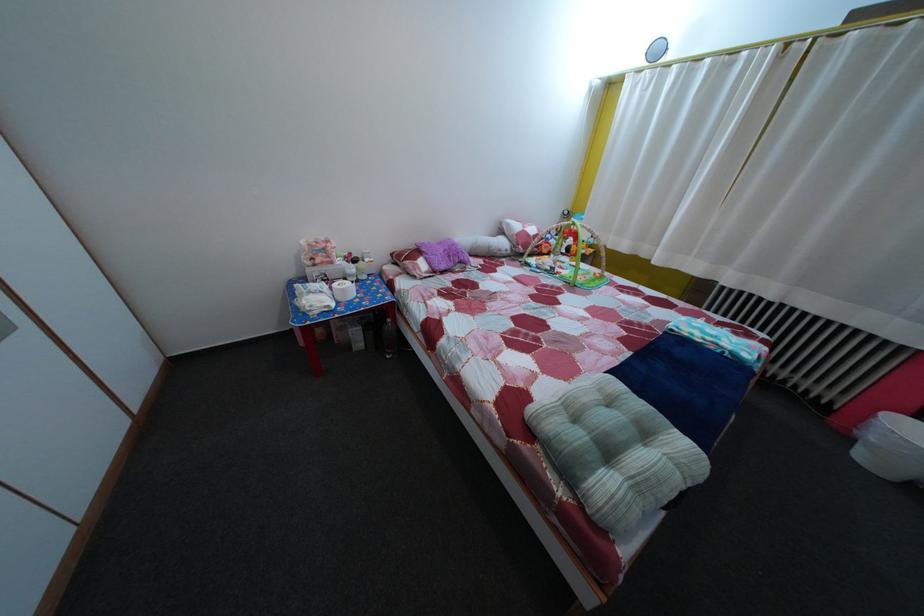
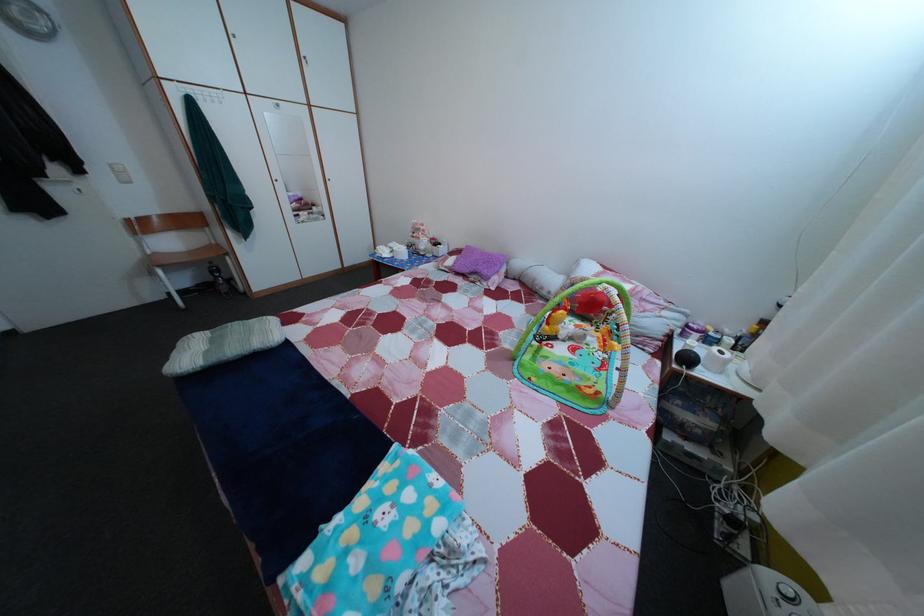
In the second image, find the point that corresponds to (x=514, y=260) in the first image.

(553, 301)